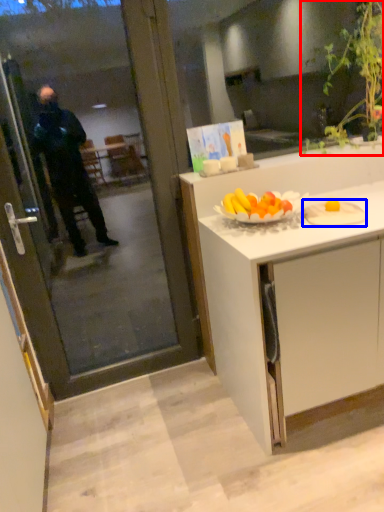
Question: Among these objects, which one is farthest to the camera, houseplant (highlighted by a red box) or plate (highlighted by a blue box)?

Choices:
 (A) houseplant
 (B) plate

Answer: (A)